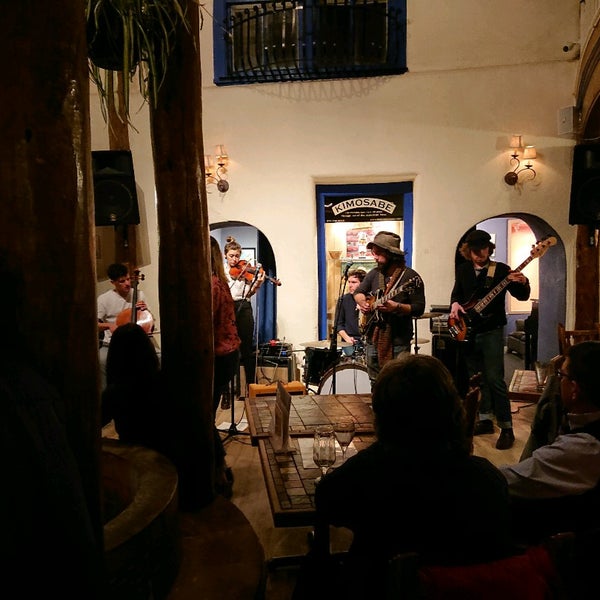
Locate an element on the screen. The height and width of the screenshot is (600, 600). clear drink glasses is located at coordinates (346, 432), (319, 443).